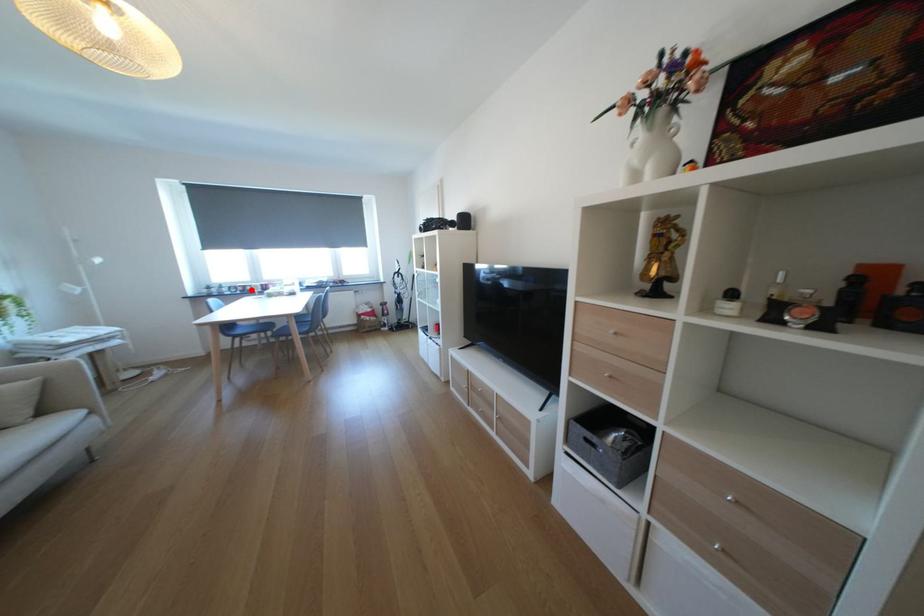
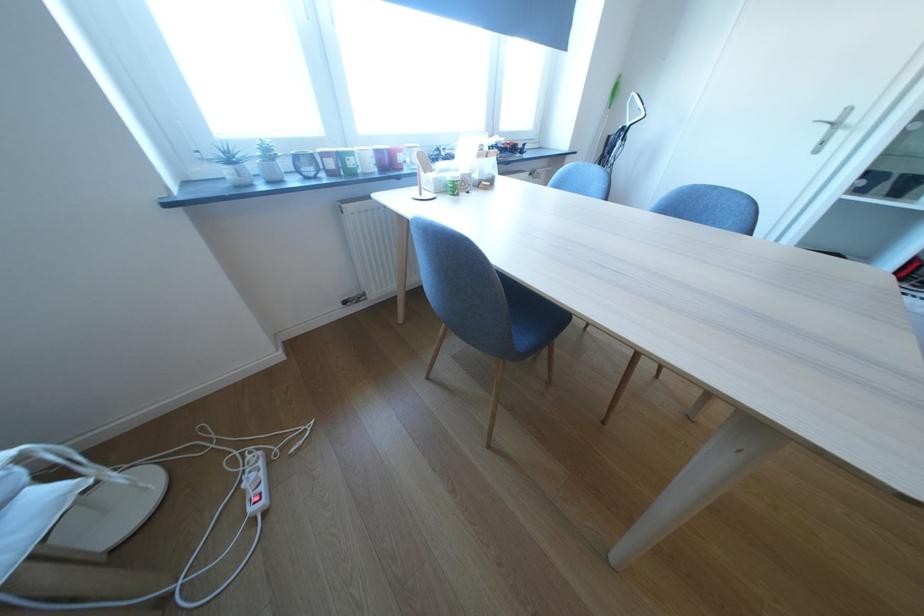
Where in the second image is the point corresponding to the highlighted location from the first image?

(342, 164)